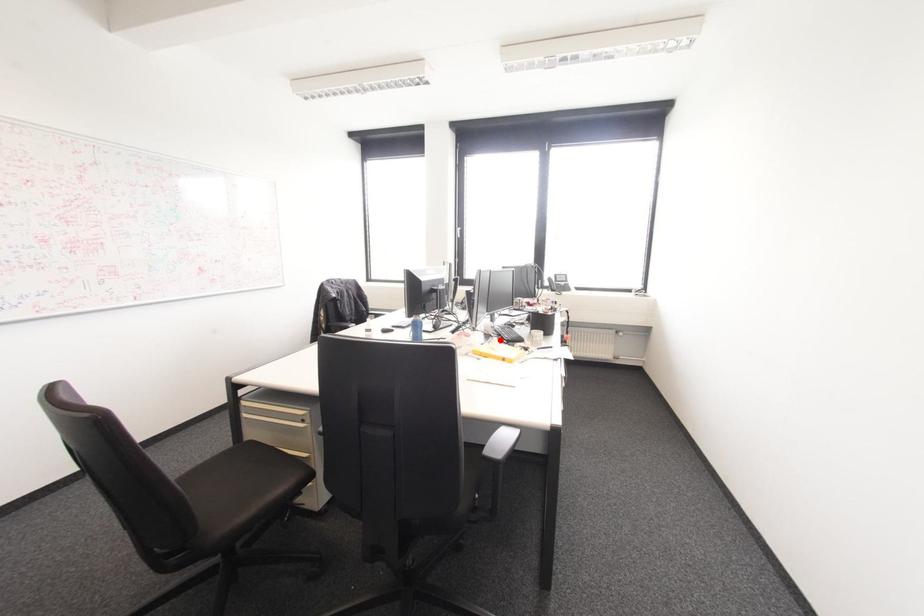
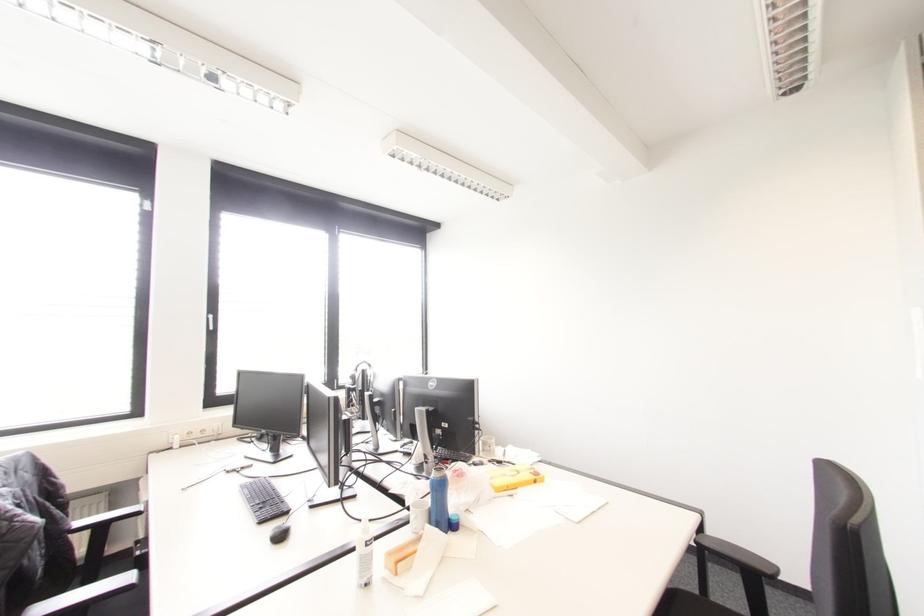
Question: I am providing you with two images of the same scene from different viewpoints. A red point is marked on the first image. At the location where the point appears in image 1, is it still visible in image 2?

Choices:
 (A) Yes
 (B) No

Answer: (B)